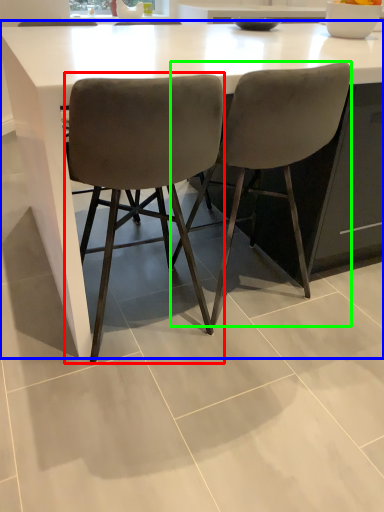
Question: Considering the real-world distances, which object is farthest from chair (highlighted by a red box)? table (highlighted by a blue box) or chair (highlighted by a green box)?

Choices:
 (A) table
 (B) chair

Answer: (A)